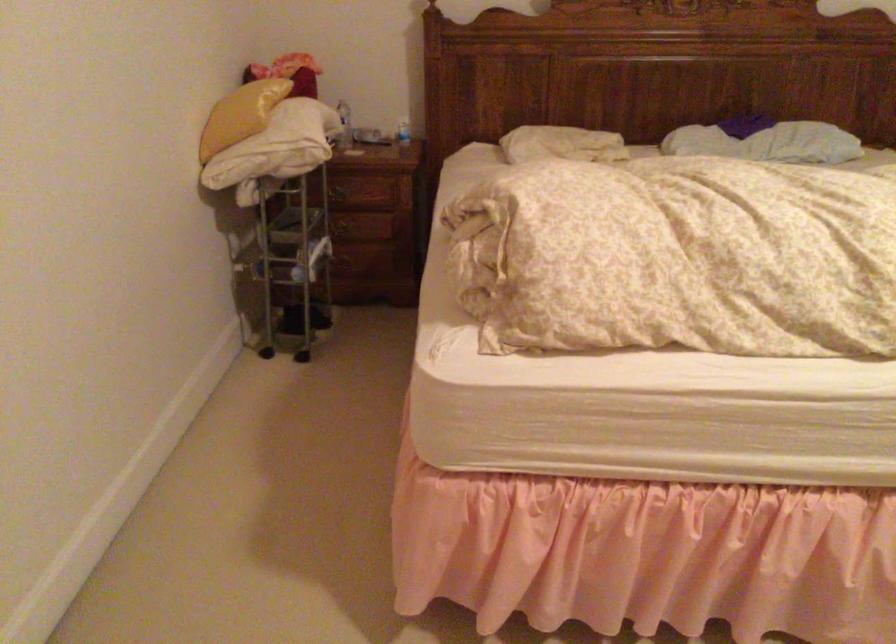
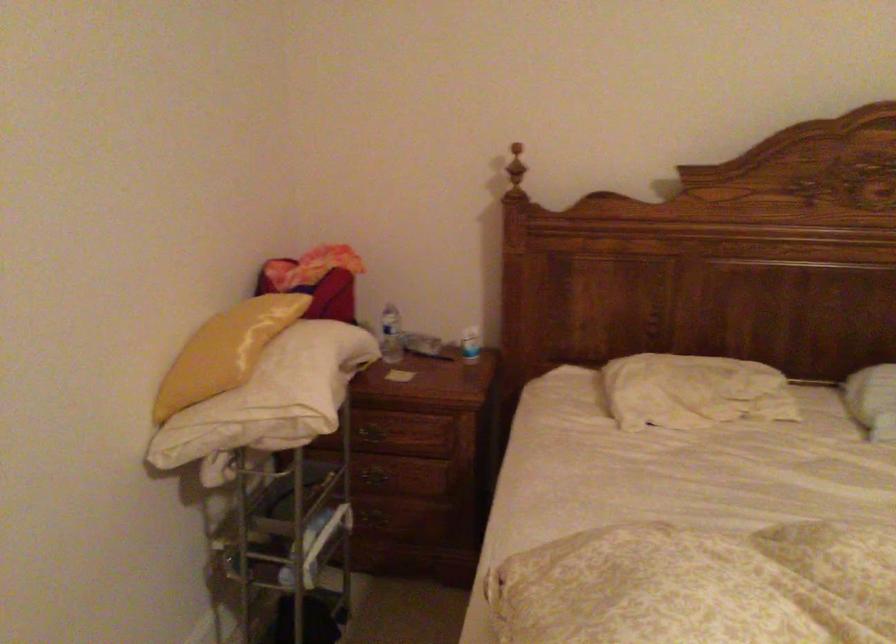
In the second image, find the point that corresponds to point 295,122 in the first image.

(287, 375)